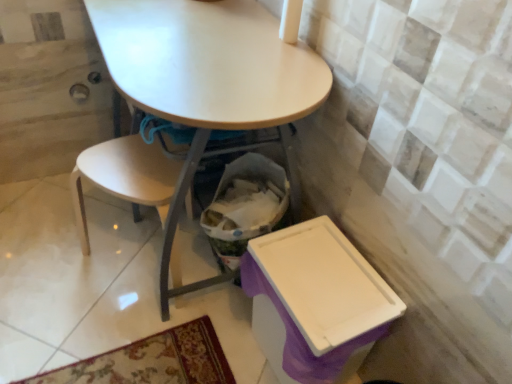
Question: Considering the relative positions of matte white table at center and purple plastic box at lower right in the image provided, is matte white table at center in front of purple plastic box at lower right?

Choices:
 (A) no
 (B) yes

Answer: (B)

Question: Considering the relative sizes of matte white table at center and purple plastic box at lower right in the image provided, is matte white table at center shorter than purple plastic box at lower right?

Choices:
 (A) yes
 (B) no

Answer: (B)

Question: Is matte white table at center not close to purple plastic box at lower right?

Choices:
 (A) yes
 (B) no

Answer: (B)

Question: From the image's perspective, is matte white table at center on purple plastic box at lower right?

Choices:
 (A) yes
 (B) no

Answer: (A)

Question: From a real-world perspective, is matte white table at center located beneath purple plastic box at lower right?

Choices:
 (A) yes
 (B) no

Answer: (B)

Question: Is purple plastic box at lower right taller or shorter than matte white table at center?

Choices:
 (A) short
 (B) tall

Answer: (A)

Question: Is purple plastic box at lower right in front of or behind matte white table at center in the image?

Choices:
 (A) behind
 (B) front

Answer: (A)

Question: Based on their positions, is purple plastic box at lower right located to the left or right of matte white table at center?

Choices:
 (A) left
 (B) right

Answer: (B)

Question: From a real-world perspective, is purple plastic box at lower right positioned above or below matte white table at center?

Choices:
 (A) below
 (B) above

Answer: (A)

Question: In terms of height, does matte white table at center look taller or shorter compared to purple plastic box at lower right?

Choices:
 (A) tall
 (B) short

Answer: (A)

Question: Is point (172, 54) positioned closer to the camera than point (352, 246)?

Choices:
 (A) farther
 (B) closer

Answer: (B)

Question: Is matte white table at center to the left or to the right of purple plastic box at lower right in the image?

Choices:
 (A) left
 (B) right

Answer: (A)

Question: In terms of size, does matte white table at center appear bigger or smaller than purple plastic box at lower right?

Choices:
 (A) big
 (B) small

Answer: (A)

Question: Is point (200, 147) positioned closer to the camera than point (119, 193)?

Choices:
 (A) farther
 (B) closer

Answer: (B)

Question: From a real-world perspective, is matte white table at center physically located above or below light wood chair at lower left?

Choices:
 (A) below
 (B) above

Answer: (B)